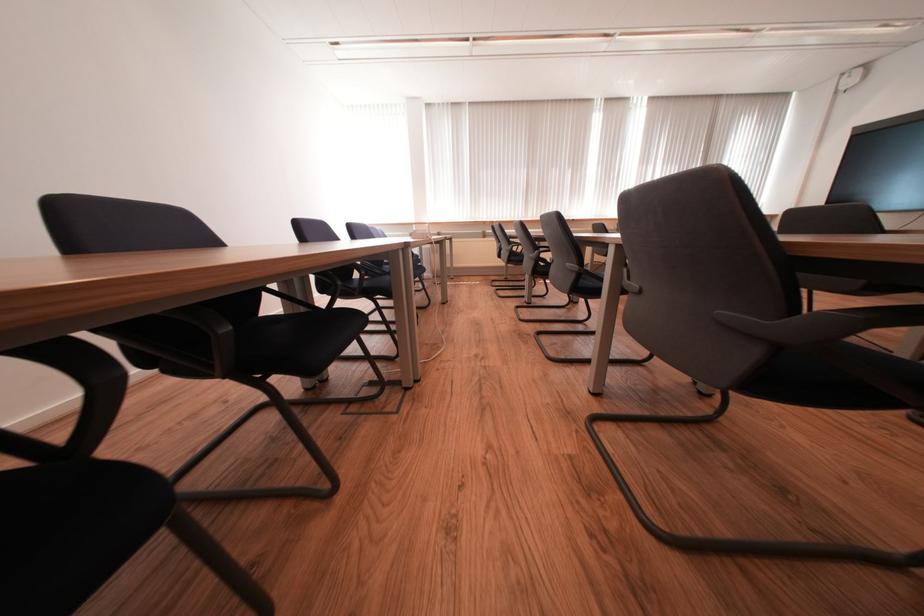
What do you see at coordinates (92, 365) in the screenshot? I see `the black chair armrest` at bounding box center [92, 365].